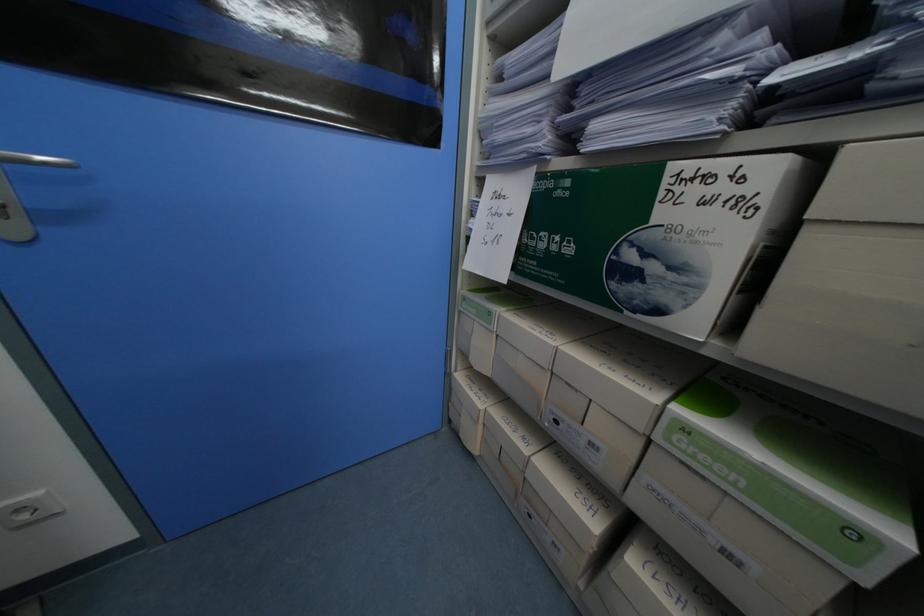
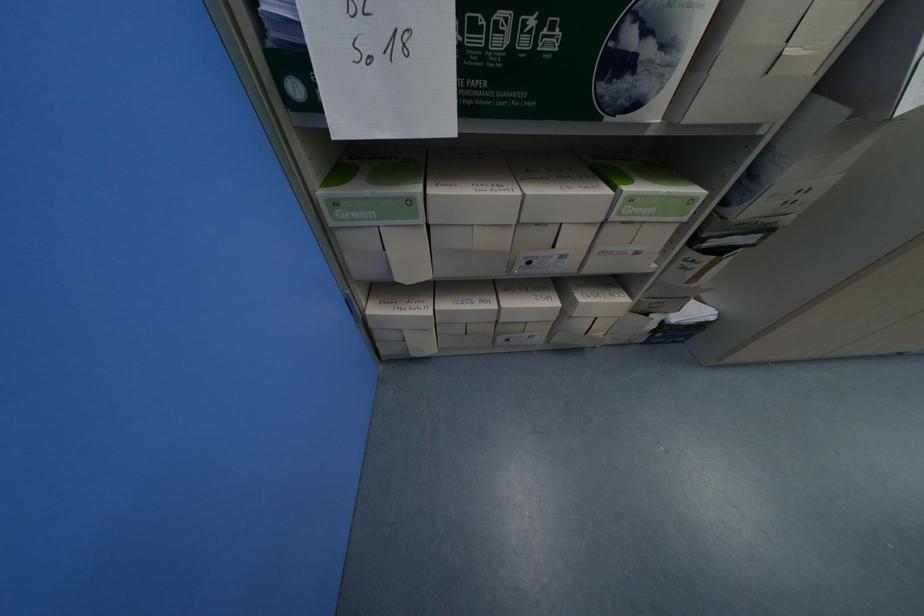
Find the pixel in the second image that matches point (693, 431) in the first image.

(638, 200)